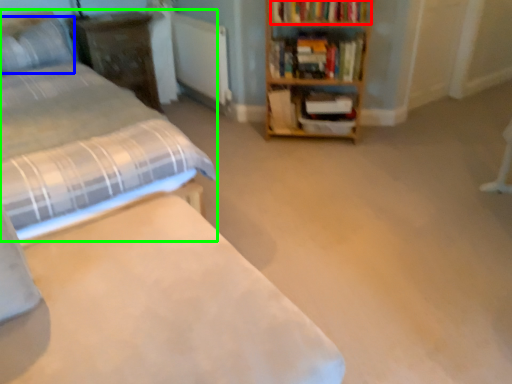
Question: Which object is the farthest from book (highlighted by a red box)? Choose among these: pillow (highlighted by a blue box) or bed (highlighted by a green box).

Choices:
 (A) pillow
 (B) bed

Answer: (A)